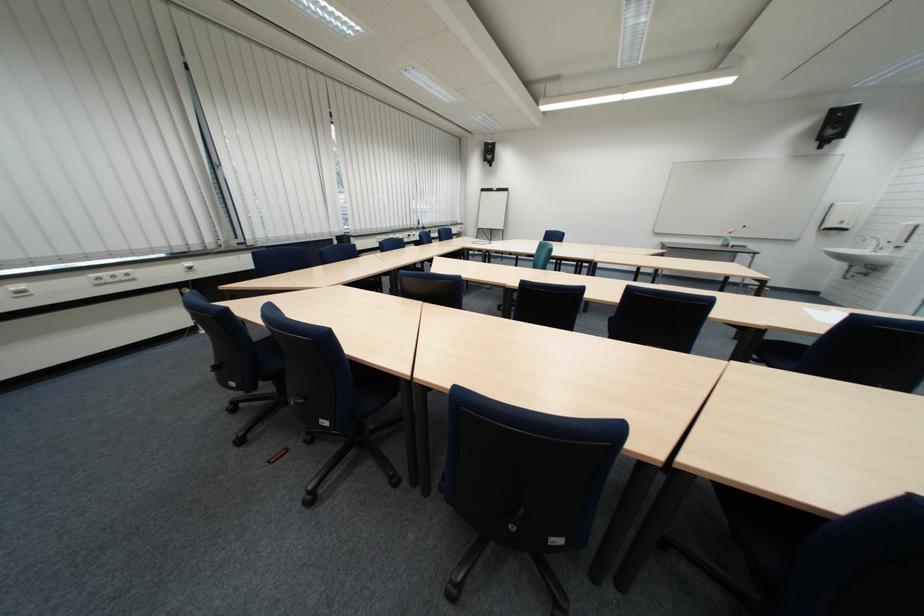
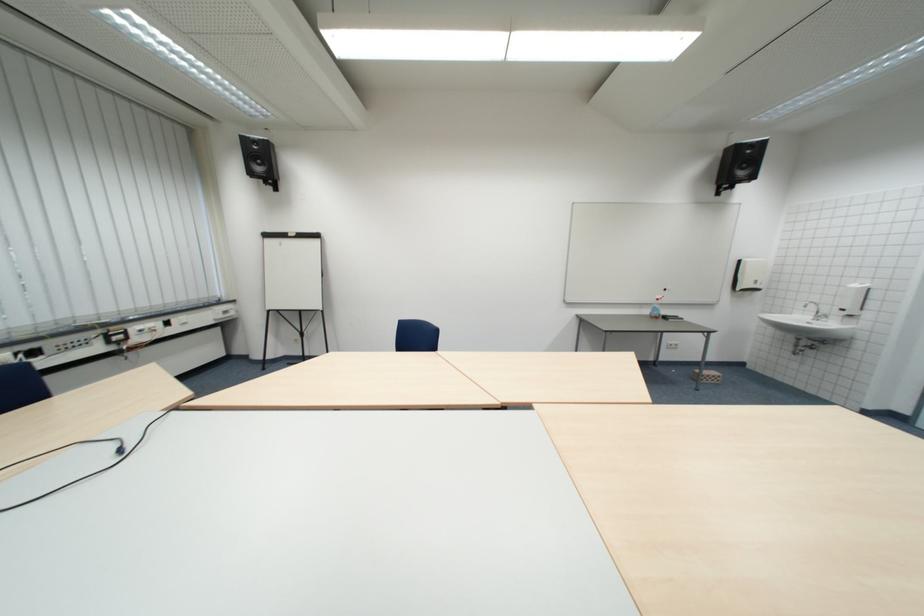
What movement of the cameraman would produce the second image?

The cameraman moved toward right, forward.